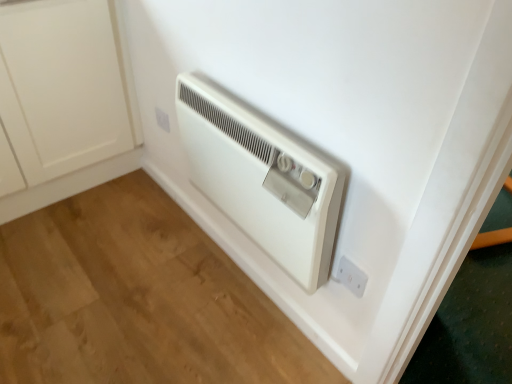
Question: Is point (161, 122) positioned closer to the camera than point (201, 119)?

Choices:
 (A) closer
 (B) farther

Answer: (B)

Question: Considering their positions, is white plastic electric outlet at lower center, which ranks as the second electric outlet in bottom-to-top order, located in front of or behind white plastic heater at center?

Choices:
 (A) behind
 (B) front

Answer: (A)

Question: Which is farther from the white matte cabinet at lower left?

Choices:
 (A) white plastic heater at center
 (B) white plastic electric outlet at lower center, which is the 2th electric outlet from front to back
 (C) white plastic electric outlet at lower right, positioned as the first electric outlet in right-to-left order

Answer: (C)

Question: Estimate the real-world distances between objects in this image. Which object is farther from the white plastic electric outlet at lower right, positioned as the 2th electric outlet in back-to-front order?

Choices:
 (A) white plastic electric outlet at lower center, placed as the first electric outlet when sorted from top to bottom
 (B) white plastic heater at center
 (C) white matte cabinet at lower left

Answer: (C)